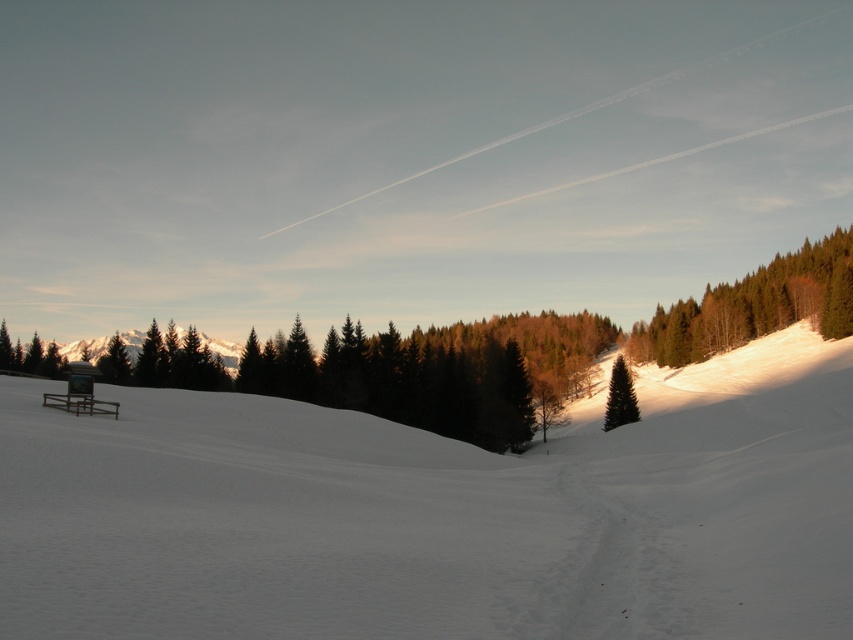
Question: Which point is closer to the camera?

Choices:
 (A) (73, 476)
 (B) (606, 420)
 (C) (782, 262)

Answer: (A)

Question: Is the position of green matte tree at upper right less distant than that of green matte tree at right?

Choices:
 (A) yes
 (B) no

Answer: (B)

Question: Is white snow at center positioned at the back of green matte tree at upper right?

Choices:
 (A) yes
 (B) no

Answer: (B)

Question: Which point is farther to the camera?

Choices:
 (A) green matte tree at upper right
 (B) white snow at center
 (C) green matte tree at right

Answer: (A)

Question: Is the position of green matte tree at upper right less distant than that of green matte tree at right?

Choices:
 (A) no
 (B) yes

Answer: (A)

Question: Which object appears farthest from the camera in this image?

Choices:
 (A) white snow at center
 (B) green matte tree at upper right

Answer: (B)